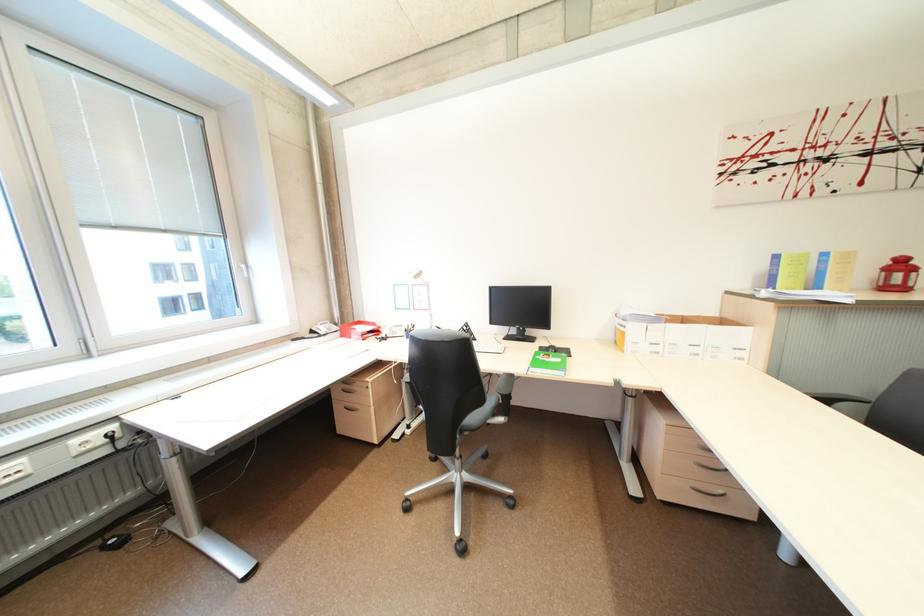
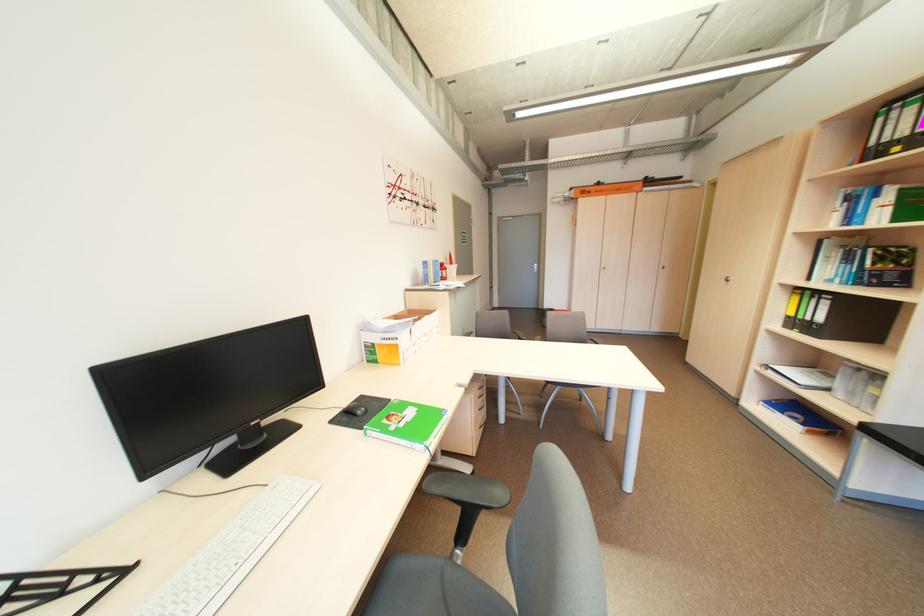
The point at (562, 345) is marked in the first image. Where is the corresponding point in the second image?

(354, 406)